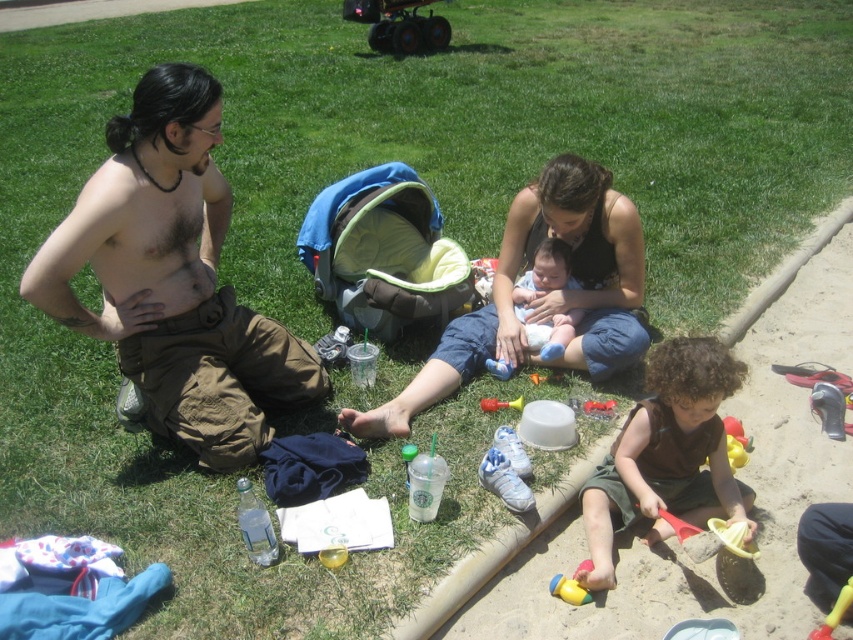
Does point (338, 257) lie behind point (573, 580)?

Yes, it is behind point (573, 580).

Which is in front, point (415, 314) or point (554, 589)?

Point (554, 589) is in front.

Find the location of a particular element. green fabric baby carriage at center is located at coordinates (383, 252).

What do you see at coordinates (154, 234) in the screenshot? I see `hairy skin at center` at bounding box center [154, 234].

Which is in front, point (195, 252) or point (587, 403)?

Positioned in front is point (195, 252).

You are a GUI agent. You are given a task and a screenshot of the screen. Output one action in this format:
    pyautogui.click(x=<x>, y=<y>)
    Task: Click on the hairy skin at center
    
    Given the screenshot: What is the action you would take?
    pyautogui.click(x=154, y=234)

Who is positioned more to the left, matte black tank top at center or rubber yellow toy at lower center?

matte black tank top at center

Between matte black tank top at center and rubber yellow toy at lower center, which one has more height?

matte black tank top at center

Between point (450, 372) and point (520, 406), which one is positioned behind?

The point (450, 372) is behind.

This screenshot has width=853, height=640. Identify the location of matte black tank top at center. (540, 298).